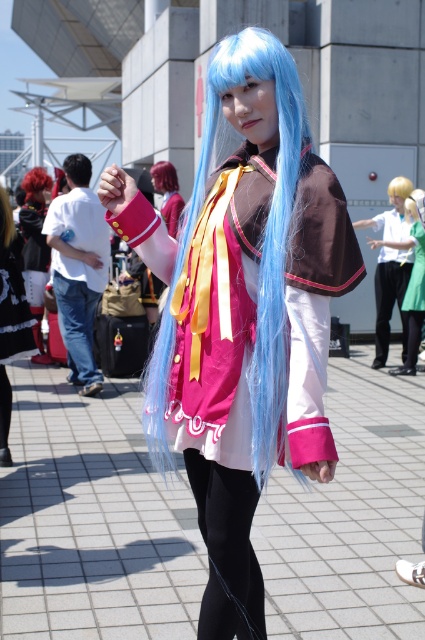
Is point (180, 429) more distant than point (48, 184)?

No, it is in front of (48, 184).

Is matte blue wig at center taller than vivid red hair at center?

Correct, matte blue wig at center is much taller as vivid red hair at center.

Is point (240, 337) farther from camera compared to point (34, 188)?

That is False.

I want to click on matte blue wig at center, so click(243, 314).

Does point (411, 230) come behind point (405, 314)?

No.

Looking at this image, is matte pink blouse at center thinner than black smooth pants at lower right?

Correct, matte pink blouse at center's width is less than black smooth pants at lower right's.

The width and height of the screenshot is (425, 640). Identify the location of matte pink blouse at center. (413, 285).

Is matte black dress at lower left further to camera compared to vivid red hair at center?

No, it is not.

Can you confirm if matte black dress at lower left is taller than vivid red hair at center?

Yes.

Between point (27, 336) and point (45, 177), which one is positioned in front?

Positioned in front is point (27, 336).

Find the location of a particular element. Image resolution: width=425 pixels, height=640 pixels. matte black dress at lower left is located at coordinates (11, 320).